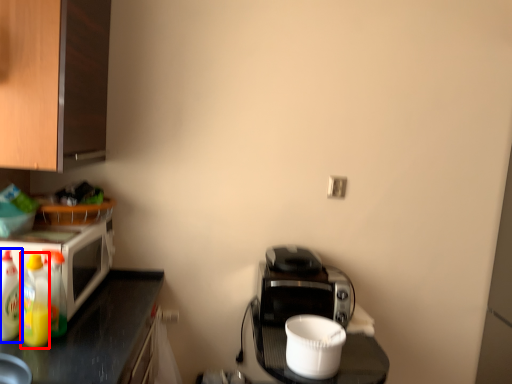
Question: Which object is further to the camera taking this photo, bottle (highlighted by a red box) or bottle (highlighted by a blue box)?

Choices:
 (A) bottle
 (B) bottle

Answer: (B)